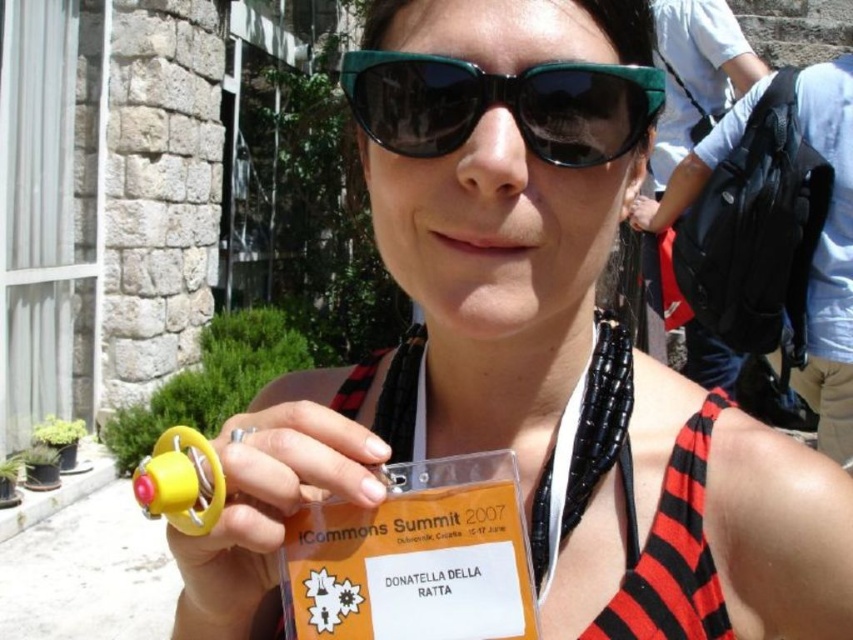
You are a photographer at the beach. You need to capture both the green plastic sunglasses at center and the red striped bikini top at center in a single shot. Based on their positions, which object will appear smaller in the photo?

The green plastic sunglasses at center will appear smaller in the photo because it has a lesser height compared to the red striped bikini top at center.

You are standing in front of the stone building and want to take a photo that includes both the point at position [622,115] and the point at [631,572]. Which point should you focus on to ensure both are in focus?

You should focus on the point at [631,572] because it is farther from the camera, ensuring the closer point at [622,115] will also be in focus due to depth of field.

You are a photographer at the beach and need to decide which object to focus on for a closeup shot. The yellow rubber ring at lower left and the red striped bikini top at center are both in your view. Which object has a smaller width and would require less zoom to capture fully?

The yellow rubber ring at lower left is thinner than the red striped bikini top at center, so it has a smaller width and would require less zoom to capture fully.